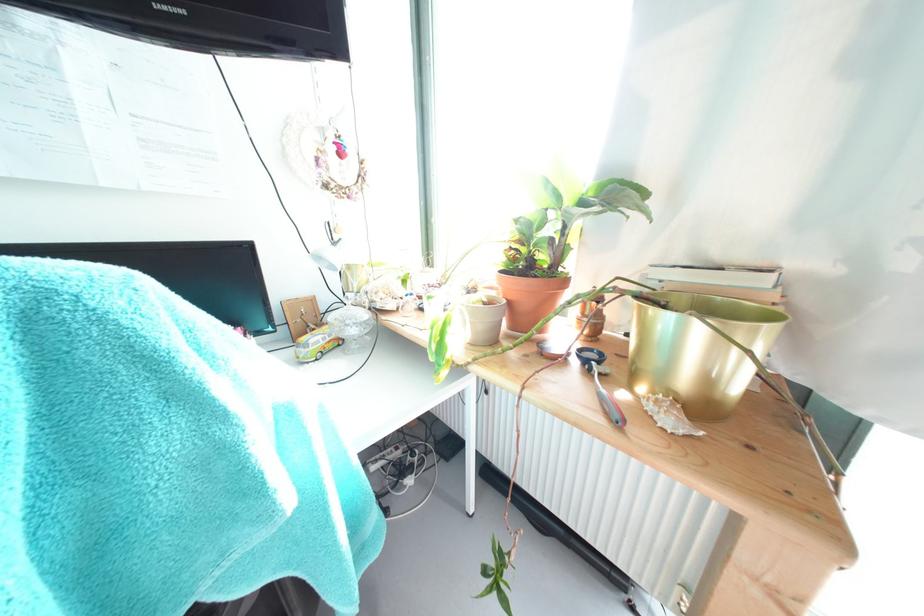
Find where to lift the small toy bus. Please return your answer as a coordinate pair (x, y).

(314, 344)